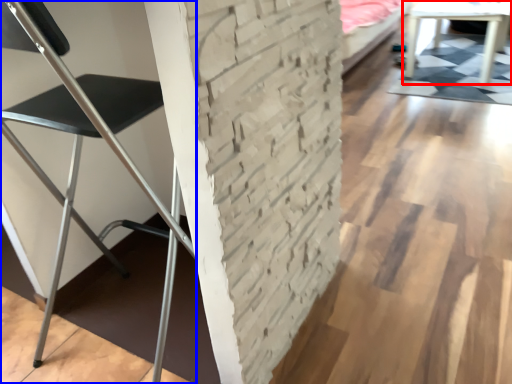
Question: Which of the following is the closest to the observer, table (highlighted by a red box) or chair (highlighted by a blue box)?

Choices:
 (A) table
 (B) chair

Answer: (B)